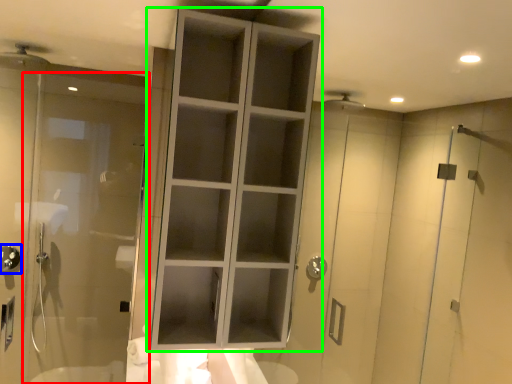
Question: Which is farther away from door (highlighted by a red box)? shower (highlighted by a blue box) or cupboard (highlighted by a green box)?

Choices:
 (A) shower
 (B) cupboard

Answer: (B)